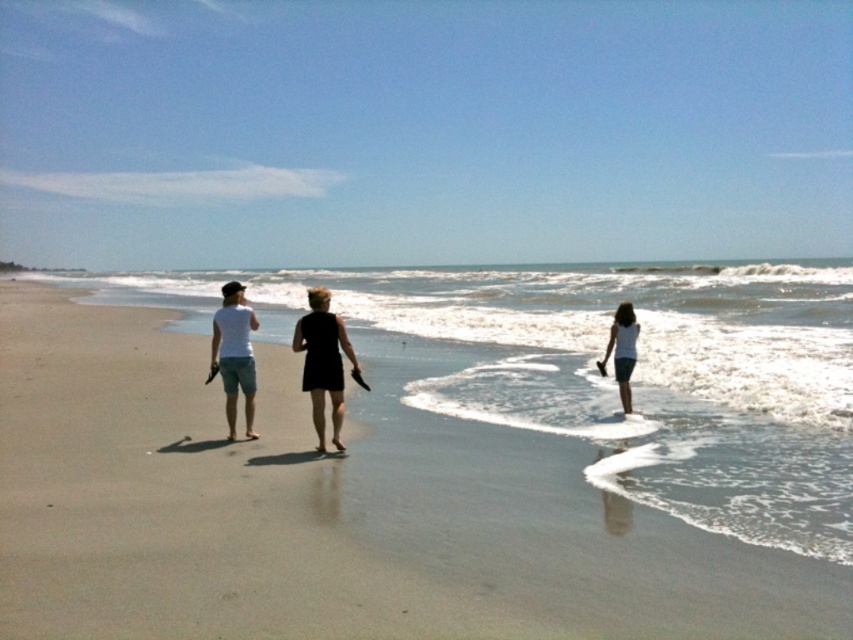
Is white cotton shirt at center smaller than matte white t-shirt at left?

Incorrect, white cotton shirt at center is not smaller in size than matte white t-shirt at left.

Can you confirm if white cotton shirt at center is positioned above matte white t-shirt at left?

Actually, white cotton shirt at center is below matte white t-shirt at left.

Between point (305, 317) and point (234, 337), which one is positioned in front?

Point (305, 317) is more forward.

The width and height of the screenshot is (853, 640). I want to click on white cotton shirt at center, so click(x=323, y=362).

Which of these two, white cotton shirt at center or white matte dress at center, stands taller?

With more height is white cotton shirt at center.

Does white cotton shirt at center have a lesser height compared to white matte dress at center?

Incorrect, white cotton shirt at center's height does not fall short of white matte dress at center's.

Who is more distant from viewer, (215, 337) or (605, 356)?

The point (605, 356) is behind.

Where is `white cotton shirt at center`? white cotton shirt at center is located at coordinates [x=323, y=362].

Which is more to the right, black matte dress at center or white matte dress at center?

white matte dress at center is more to the right.

From the picture: Can you confirm if black matte dress at center is thinner than white matte dress at center?

Yes, black matte dress at center is thinner than white matte dress at center.

Between point (318, 294) and point (619, 394), which one is positioned in front?

Positioned in front is point (318, 294).

I want to click on black matte dress at center, so tap(323, 362).